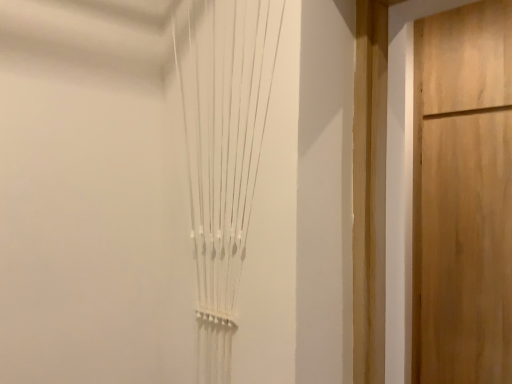
Describe the element at coordinates (463, 195) in the screenshot. I see `light brown wood door at right` at that location.

Locate an element on the screen. light brown wood door at right is located at coordinates (463, 195).

Identify the location of light brown wood door at right. This screenshot has height=384, width=512. coord(463,195).